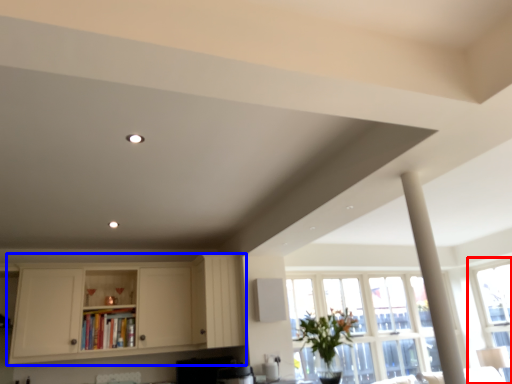
Question: Which of the following is the farthest to the observer, window (highlighted by a red box) or cabinetry (highlighted by a blue box)?

Choices:
 (A) window
 (B) cabinetry

Answer: (A)